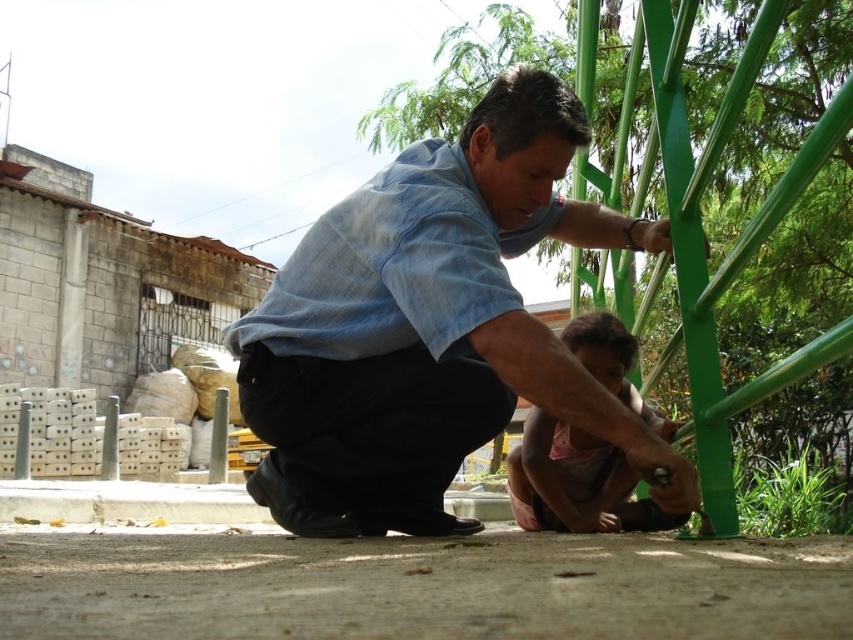
Who is more distant from viewer, (454, 388) or (619, 397)?

The point (619, 397) is behind.

Is blue denim shirt at center to the left of pink fabric shirt at lower center from the viewer's perspective?

Indeed, blue denim shirt at center is positioned on the left side of pink fabric shirt at lower center.

At what (x,y) coordinates should I click in order to perform the action: click on blue denim shirt at center. Please return your answer as a coordinate pair (x, y). The width and height of the screenshot is (853, 640). Looking at the image, I should click on (430, 326).